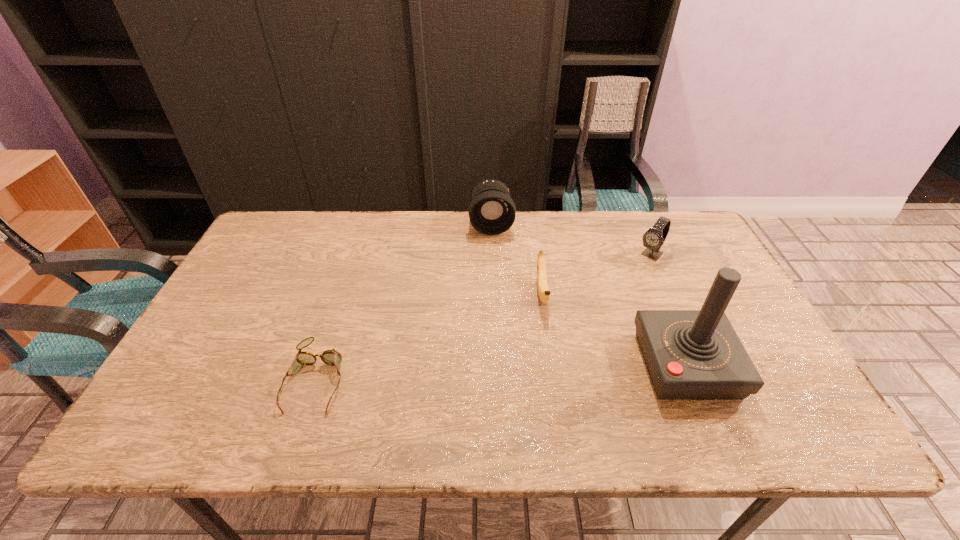
Find the location of `the leftmost object`. the leftmost object is located at coordinates (331, 357).

Identify the location of the shortest object. (331, 357).

This screenshot has width=960, height=540. Identify the location of the tallest object. (690, 354).

Locate an element on the screen. Image resolution: width=960 pixels, height=540 pixels. watch is located at coordinates (654, 237).

Locate an element on the screen. the third tallest object is located at coordinates (654, 237).

The height and width of the screenshot is (540, 960). What are the coordinates of `the fourth object from right to left` in the screenshot? It's located at (492, 211).

Find the location of a particular element. Image resolution: width=960 pixels, height=540 pixels. telephoto lens is located at coordinates (492, 211).

Find the location of a particular element. This screenshot has height=540, width=960. the fourth tallest object is located at coordinates (544, 293).

Where is `banana`? banana is located at coordinates (544, 293).

In order to click on blank area located 0.110m on the rectangular base of the tallest object in this screenshot , I will do `click(777, 365)`.